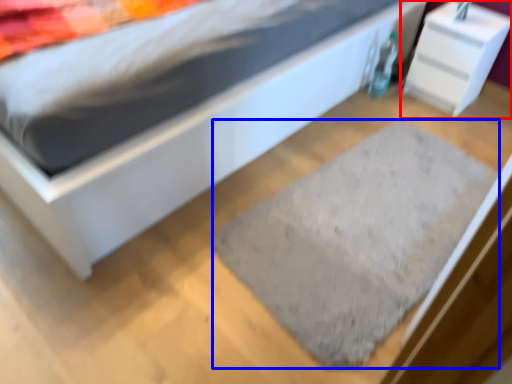
Question: Among these objects, which one is nearest to the camera, nightstand (highlighted by a red box) or doormat (highlighted by a blue box)?

Choices:
 (A) nightstand
 (B) doormat

Answer: (B)